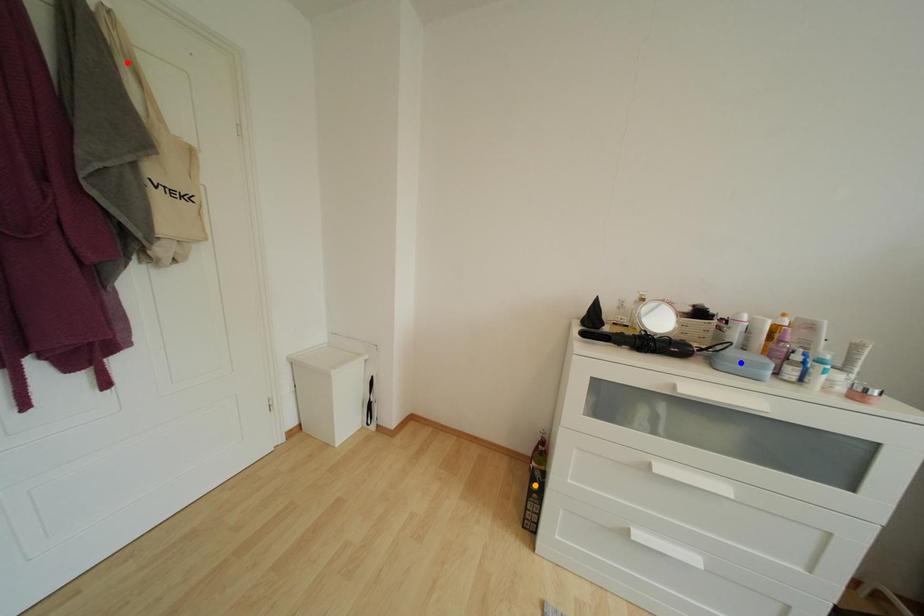
Order these from nearest to farthest:
red point
blue point
orange point

red point, blue point, orange point